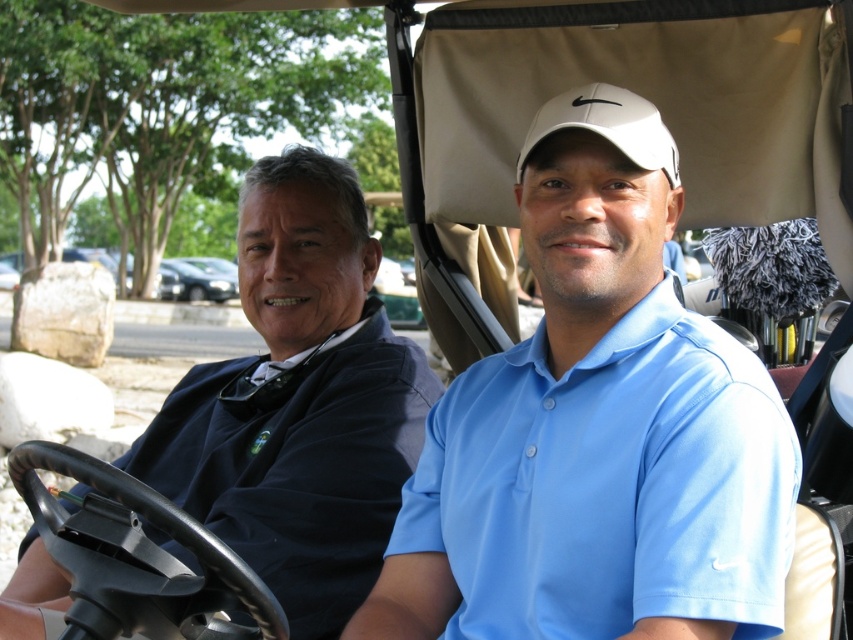
You are a photographer trying to capture a clear photo of both the blue matte shirt at center and the dark blue shirt at left. Since you want both shirts to be visible in the photo, which shirt should you focus on to ensure both are in focus?

The blue matte shirt at center is in front of the dark blue shirt at left. To ensure both are in focus, you should focus on the dark blue shirt at left since it is farther back, and the depth of field will include the closer blue matte shirt at center as well.

You are a photographer trying to capture a clear shot of both the dark blue shirt at left and the white matte baseball cap at center. Based on their positions, which object is closer to the camera?

The dark blue shirt at left is positioned under the white matte baseball cap at center, indicating it is closer to the camera.